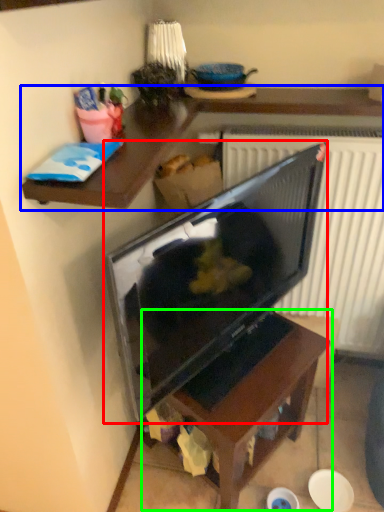
Question: Which is farther away from television (highlighted by a red box)? desk (highlighted by a blue box) or table (highlighted by a green box)?

Choices:
 (A) desk
 (B) table

Answer: (A)